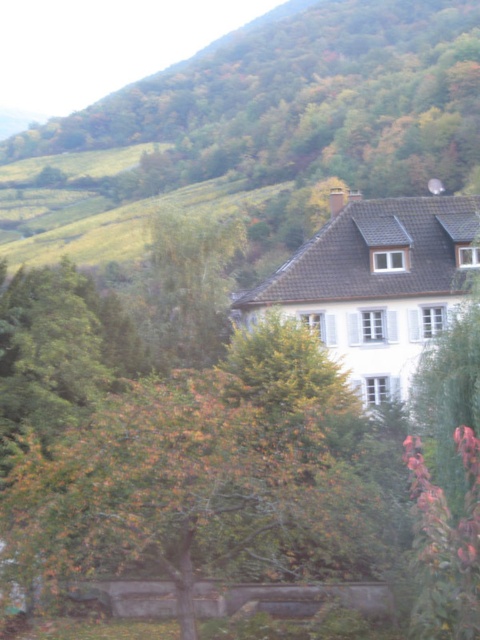
You are standing in the rural landscape and want to take a photo of the autumn leaves tree at center. To get the best shot, you need to ensure the green leafy hillside at upper center isn

The green leafy hillside at upper center is positioned over the autumn leaves tree at center, so it will appear in the background of the photo.

You are a bird flying over the rural landscape and want to land on the highest point between the green leafy hillside at upper center and the autumn leaves tree at center. Which one should you choose?

The green leafy hillside at upper center is much taller than the autumn leaves tree at center, so you should choose the green leafy hillside at upper center to land on the highest point.